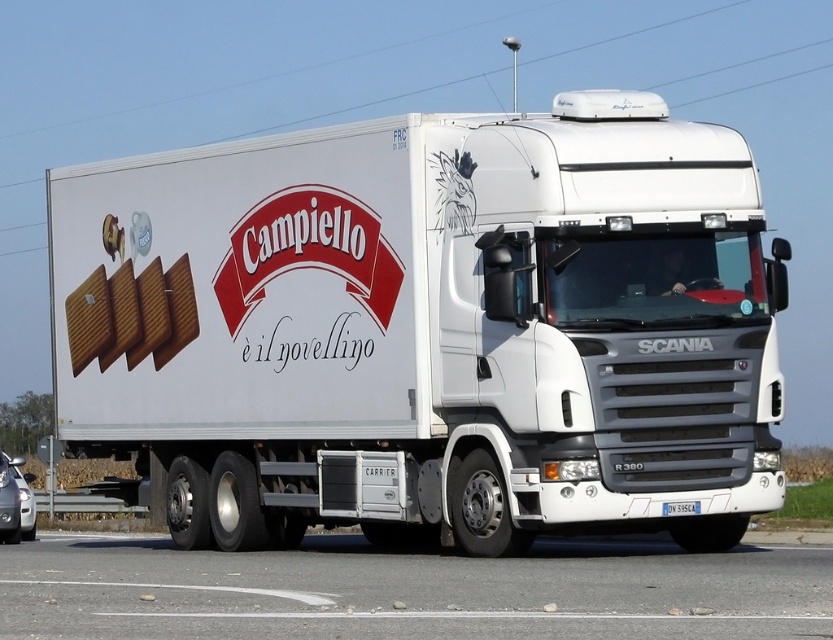
You are standing on the asphalt at lower center and want to approach the white matte truck at center. Which direction should you move in to get closer to the truck?

Since the white matte truck at center is further to the viewer than asphalt at lower center, you are already in front of the truck. To approach it, you should move backward towards where you came from.

You are a photographer planning to take a picture of the white matte truck at center and the asphalt at lower center. Based on their sizes in the image, which object should you focus on first to ensure it is in sharp focus?

The white matte truck at center is larger in size than asphalt at lower center, so you should focus on the white matte truck at center first to ensure it is in sharp focus since larger objects generally require more precise focusing to capture details clearly.